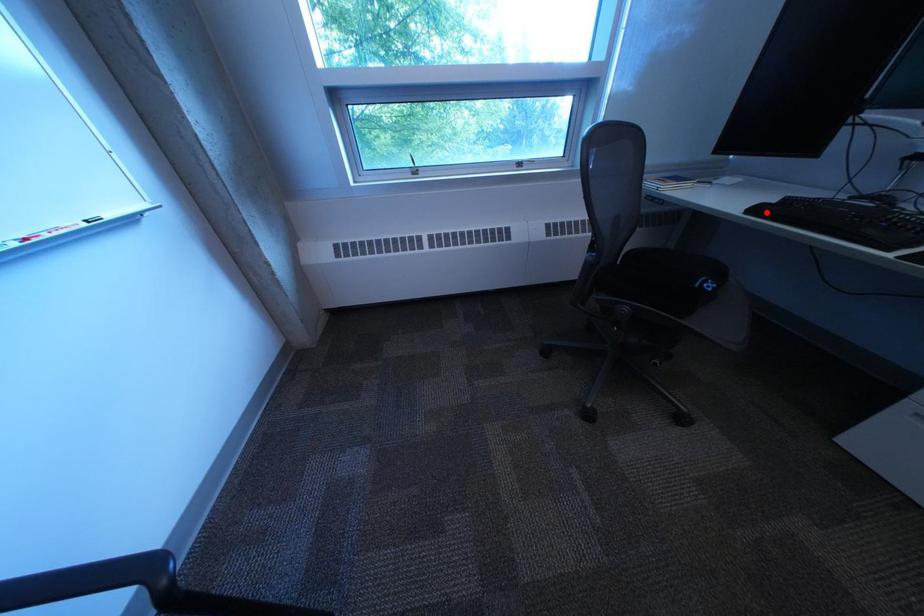
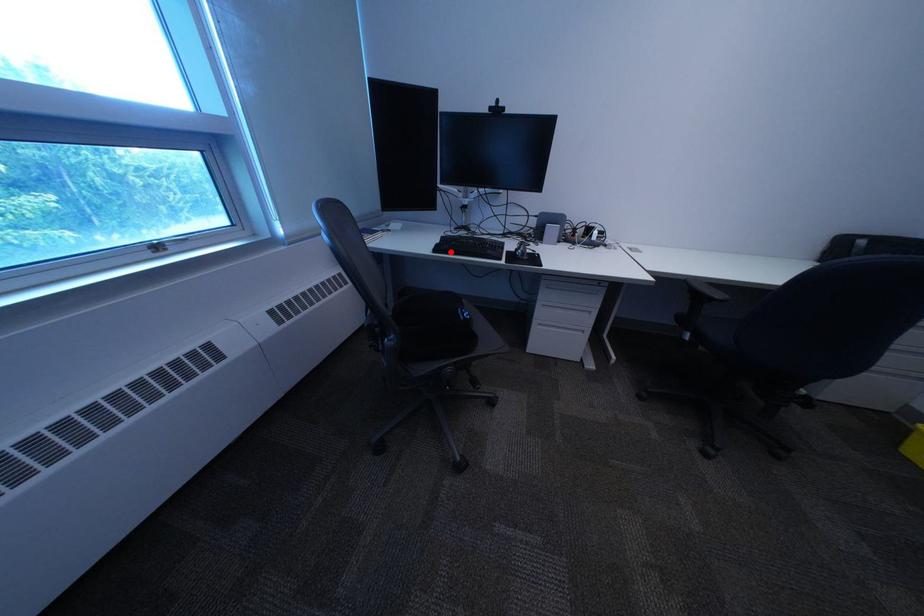
I am providing you with two images of the same scene from different viewpoints. A red point is marked on the first image and another point is marked on the second image. Is the marked point in image1 the same physical position as the marked point in image2?

Yes